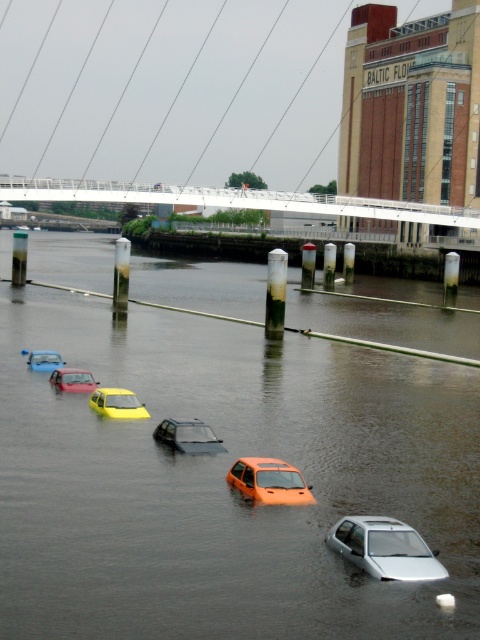
You are a rescue worker trying to navigate through the flooded area. You need to reach the pedestrian bridge in the background. Which car should you avoid passing under to prevent getting stuck? The orange matte car at center and the metallic silver car at lower left are in your path.

You should avoid passing under the orange matte car at center because it is positioned under the metallic silver car at lower left, which means the space between them is blocked.

You are a drone operator trying to capture a photo of the flooded cars from above. The white metallic bridge at upper center is in your way. To avoid it, where should you adjust your drone to fly? Please provide coordinates in the format of x,y where x and y are between 0 and 1, with 0,0 being the bottom left corner and 1,1 being the top right corner.

To avoid the white metallic bridge at upper center located at coordinates [265,205], you should adjust the drone to fly below it. A safe coordinate could be [216,205] to stay under the bridge.